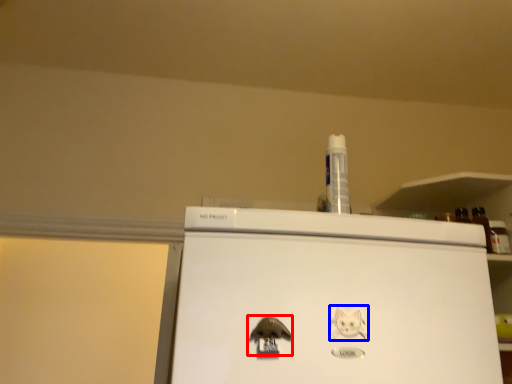
Question: Which object appears farthest to the camera in this image, animal (highlighted by a red box) or animal (highlighted by a blue box)?

Choices:
 (A) animal
 (B) animal

Answer: (B)